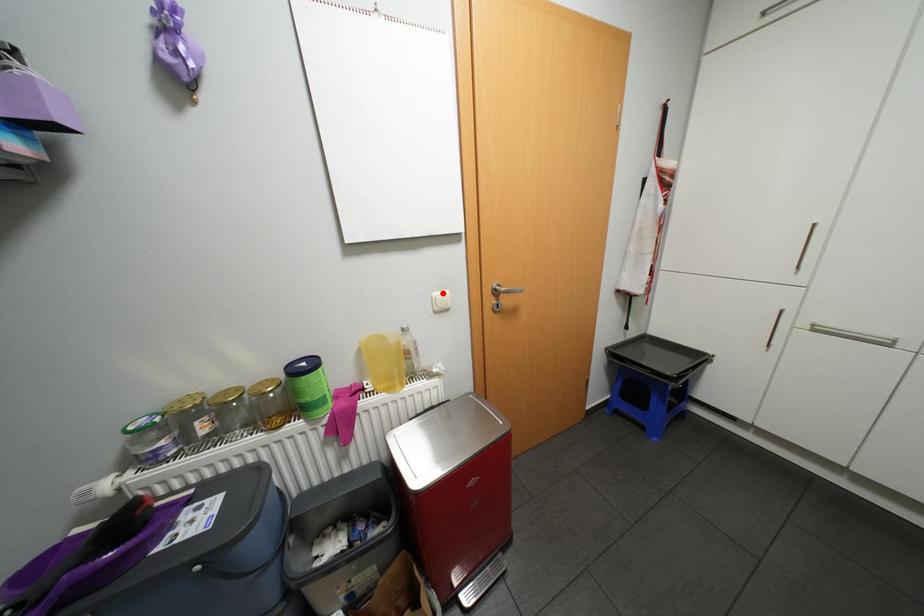
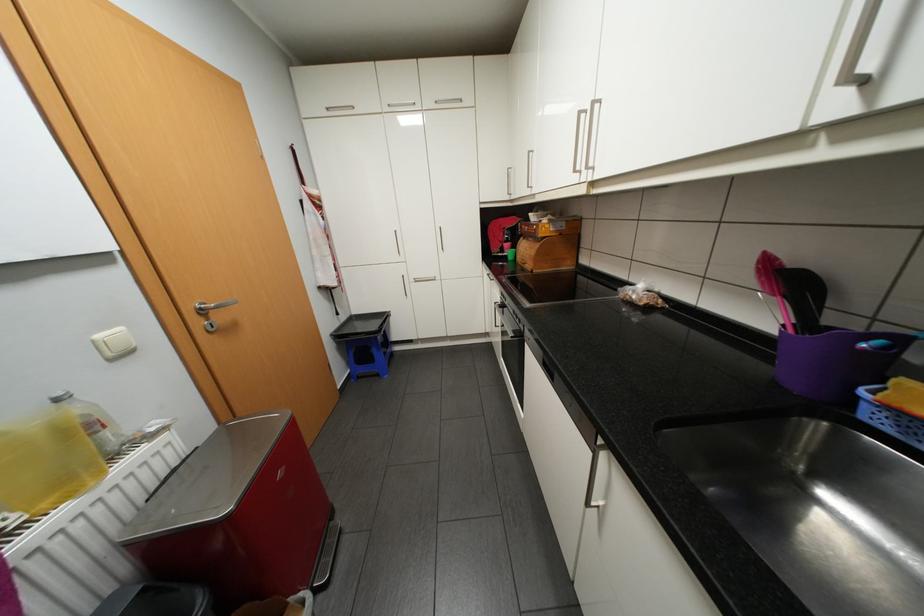
Question: I am providing you with two images of the same scene from different viewpoints. A red point is marked on the first image. At the location where the point appears in image 1, is it still visible in image 2?

Choices:
 (A) Yes
 (B) No

Answer: (A)